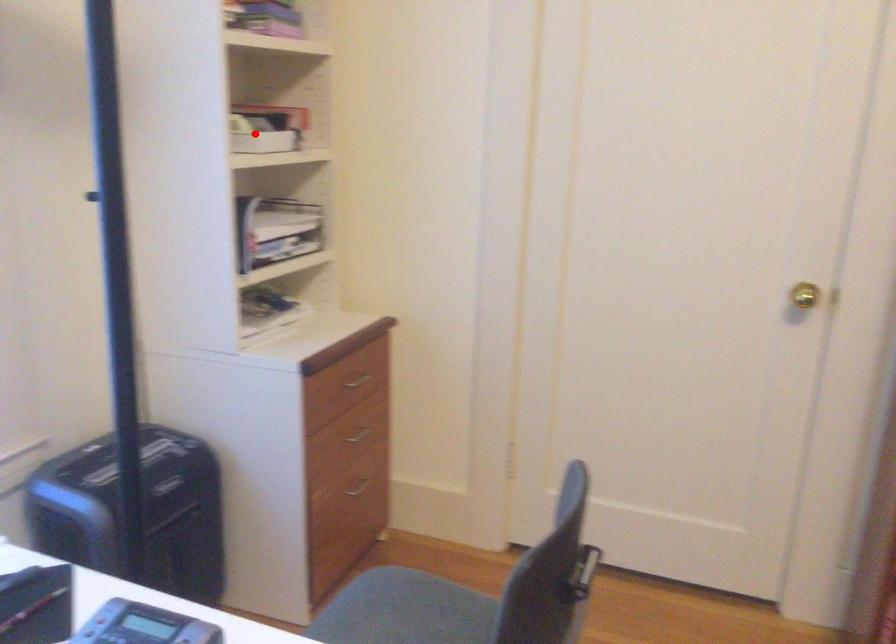
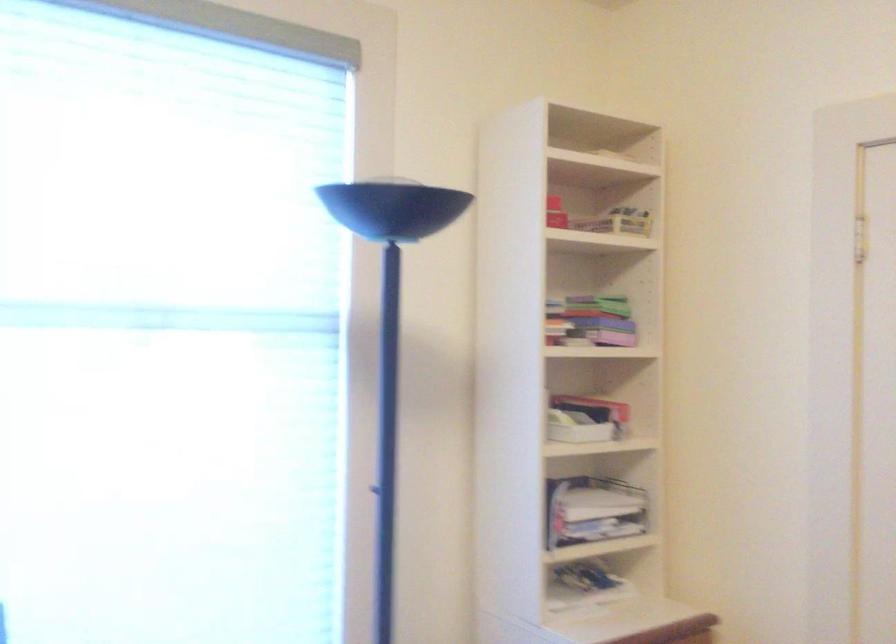
Question: I am providing you with two images of the same scene from different viewpoints. Image1 has a red point marked. In image2, the corresponding 3D location appears at what relative position? Reply with the corresponding letter.

Choices:
 (A) Closer
 (B) Farther

Answer: (B)